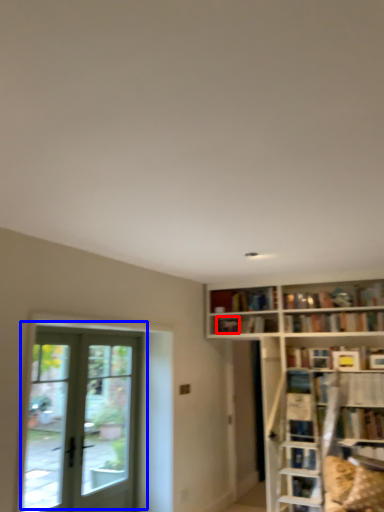
Question: Which point is closer to the camera, book (highlighted by a red box) or door (highlighted by a blue box)?

Choices:
 (A) book
 (B) door

Answer: (B)